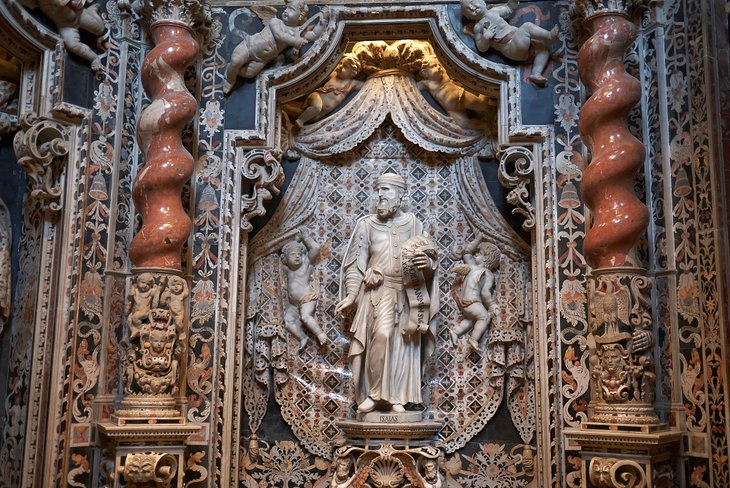
Locate an element on the screen. This screenshot has width=730, height=488. bracket is located at coordinates click(22, 164).